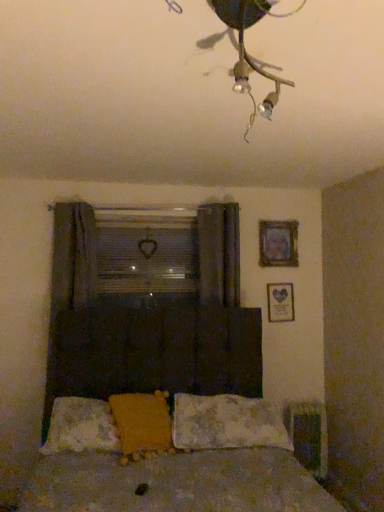
Question: Does point click(x=134, y=408) appear closer or farther from the camera than point click(x=56, y=332)?

Choices:
 (A) farther
 (B) closer

Answer: (B)

Question: Considering their positions, is yellow fuzzy pillow at center, placed as the 2th pillow when sorted from right to left, located in front of or behind dark fabric curtain at left, which appears as the 1th curtain when viewed from the left?

Choices:
 (A) front
 (B) behind

Answer: (A)

Question: Based on their relative distances, which object is nearer to the metallic silver radiator at lower right?

Choices:
 (A) yellow fuzzy pillow at center, placed as the 2th pillow when sorted from right to left
 (B) fluffy white pillow at center, placed as the first pillow when sorted from right to left
 (C) matte silver picture frame at upper right, marked as the first picture frame in a bottom-to-top arrangement
 (D) metallic wire at upper center
 (E) fluffy white pillow at lower center, which appears as the third pillow when viewed from the right

Answer: (B)

Question: Which object is positioned closest to the fluffy white pillow at lower center, the first pillow from the left?

Choices:
 (A) metallic silver radiator at lower right
 (B) dark wood bed at center
 (C) dark fabric curtain at center, which appears as the 2th curtain when viewed from the left
 (D) wooden picture frame at upper right, which is the 1th picture frame in top-to-bottom order
 (E) dark fabric curtain at left, which appears as the 1th curtain when viewed from the left

Answer: (B)